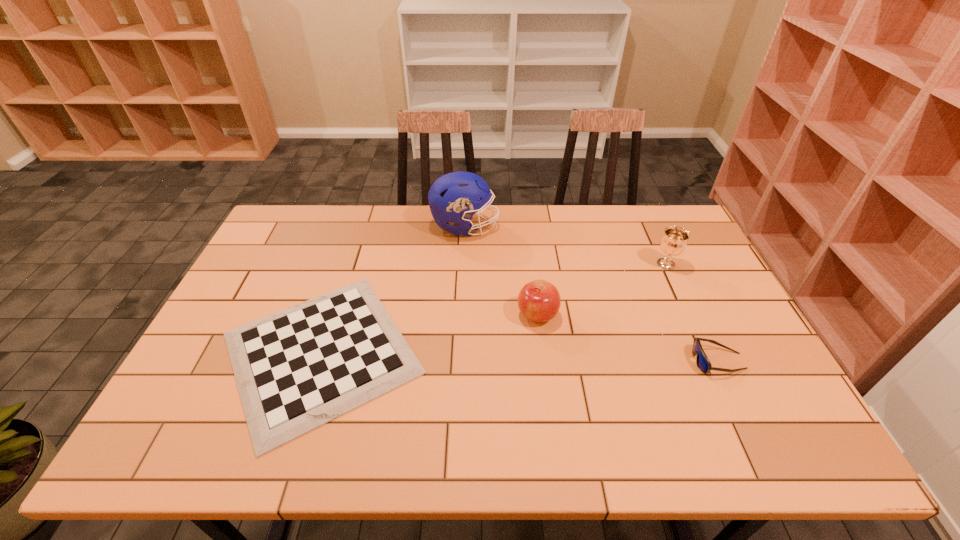
The image size is (960, 540). What are the coordinates of `free space between the sunglasses and the chalice` in the screenshot? It's located at (692, 313).

Where is `unoccupied position between the farthest object and the sunglasses`? unoccupied position between the farthest object and the sunglasses is located at coordinates (591, 294).

Image resolution: width=960 pixels, height=540 pixels. I want to click on vacant space that's between the sunglasses and the third object from left to right, so click(x=628, y=338).

Locate an element on the screen. Image resolution: width=960 pixels, height=540 pixels. vacant space that's between the fourth tallest object and the third shortest object is located at coordinates (628, 338).

Identify the location of free space between the shortest object and the second shortest object. The image size is (960, 540). (519, 357).

Identify the location of free area in between the tallest object and the chalice. This screenshot has height=540, width=960. (565, 245).

Select which object is the closest to the chessboard. Please provide its 2D coordinates. Your answer should be formatted as a tuple, i.e. [(x, y)], where the tuple contains the x and y coordinates of a point satisfying the conditions above.

[(455, 197)]

At what (x,y) coordinates should I click in order to perform the action: click on object that stands as the third closest to the third object from right to left. Please return your answer as a coordinate pair (x, y). The image size is (960, 540). Looking at the image, I should click on (703, 363).

This screenshot has height=540, width=960. Find the location of `vacant position in the image that satisfies the following two spatial constraints: 1. on the back side of the fourth nearest object; 2. on the front-facing side of the tallest object`. vacant position in the image that satisfies the following two spatial constraints: 1. on the back side of the fourth nearest object; 2. on the front-facing side of the tallest object is located at coordinates (648, 226).

At what (x,y) coordinates should I click in order to perform the action: click on free region that satisfies the following two spatial constraints: 1. on the front-facing side of the apple; 2. on the right side of the tallest object. Please return your answer as a coordinate pair (x, y). Looking at the image, I should click on (461, 314).